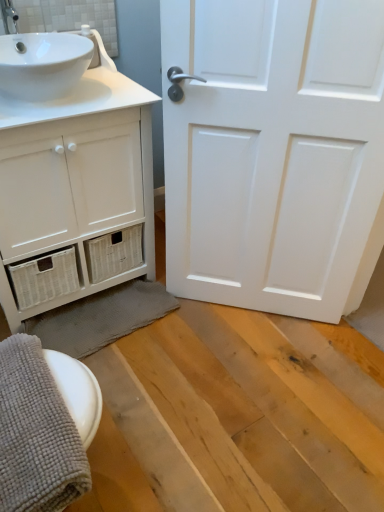
Question: Is the depth of white glossy sink at upper left greater than that of white matte door at center?

Choices:
 (A) yes
 (B) no

Answer: (A)

Question: Is white glossy sink at upper left thinner than white matte door at center?

Choices:
 (A) yes
 (B) no

Answer: (B)

Question: Does white glossy sink at upper left have a lesser height compared to white matte door at center?

Choices:
 (A) yes
 (B) no

Answer: (A)

Question: Is white glossy sink at upper left wider than white matte door at center?

Choices:
 (A) yes
 (B) no

Answer: (A)

Question: Is white glossy sink at upper left smaller than white matte door at center?

Choices:
 (A) yes
 (B) no

Answer: (A)

Question: From the image's perspective, is gray textured bath towel at lower left, which is the first bath towel in front-to-back order, above or below white matte cabinet at left?

Choices:
 (A) below
 (B) above

Answer: (A)

Question: From a real-world perspective, is gray textured bath towel at lower left, marked as the 2th bath towel in a back-to-front arrangement, above or below white matte cabinet at left?

Choices:
 (A) below
 (B) above

Answer: (A)

Question: Visually, is gray textured bath towel at lower left, which is the first bath towel in front-to-back order, positioned to the left or to the right of white matte cabinet at left?

Choices:
 (A) left
 (B) right

Answer: (B)

Question: Is gray textured bath towel at lower left, marked as the 2th bath towel in a back-to-front arrangement, wider or thinner than white matte cabinet at left?

Choices:
 (A) wide
 (B) thin

Answer: (B)

Question: Is gray textured bath towel at lower left, which is the first bath towel in front-to-back order, taller or shorter than gray textured bath towel at lower left, the first bath towel viewed from the back?

Choices:
 (A) tall
 (B) short

Answer: (A)

Question: Looking at their shapes, would you say gray textured bath towel at lower left, which is the first bath towel in front-to-back order, is wider or thinner than gray textured bath towel at lower left, the first bath towel viewed from the back?

Choices:
 (A) thin
 (B) wide

Answer: (A)

Question: Considering their positions, is gray textured bath towel at lower left, marked as the 2th bath towel in a back-to-front arrangement, located in front of or behind gray textured bath towel at lower left, which is counted as the second bath towel, starting from the front?

Choices:
 (A) front
 (B) behind

Answer: (A)

Question: Is gray textured bath towel at lower left, which is the first bath towel in front-to-back order, bigger or smaller than gray textured bath towel at lower left, which is counted as the second bath towel, starting from the front?

Choices:
 (A) big
 (B) small

Answer: (B)

Question: In terms of width, does gray textured bath towel at lower left, the first bath towel viewed from the back, look wider or thinner when compared to gray textured bath towel at lower left, which is the first bath towel in front-to-back order?

Choices:
 (A) thin
 (B) wide

Answer: (B)

Question: Considering the positions of gray textured bath towel at lower left, the first bath towel viewed from the back, and gray textured bath towel at lower left, which is the first bath towel in front-to-back order, in the image, is gray textured bath towel at lower left, the first bath towel viewed from the back, bigger or smaller than gray textured bath towel at lower left, which is the first bath towel in front-to-back order,?

Choices:
 (A) small
 (B) big

Answer: (B)